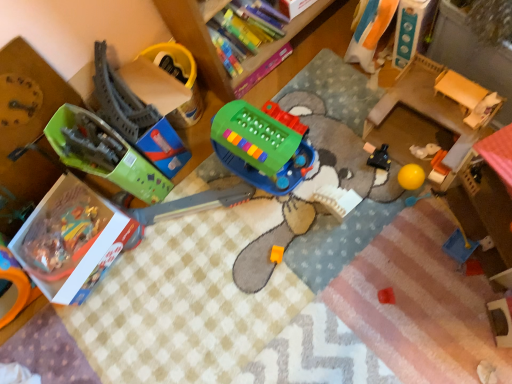
Where is `vacant area that is situated to the right of black plastic toy at center-right, which is the 5th toy in left-to-right order`? This screenshot has width=512, height=384. vacant area that is situated to the right of black plastic toy at center-right, which is the 5th toy in left-to-right order is located at coordinates (405, 138).